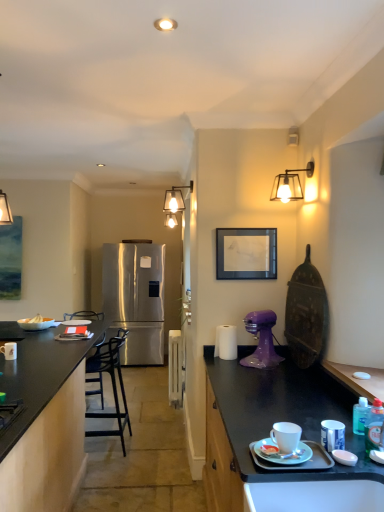
Question: From a real-world perspective, is white glossy book at center, the 1th tableware when ordered from bottom to top, below white matte plate at right, which is the second tableware from bottom to top?

Choices:
 (A) no
 (B) yes

Answer: (B)

Question: Is white glossy book at center, the 1th tableware when ordered from bottom to top, oriented away from white matte plate at right, which is the second tableware from bottom to top?

Choices:
 (A) yes
 (B) no

Answer: (B)

Question: Can you see white glossy book at center, the first tableware in the back-to-front sequence, touching white matte plate at right, which is the second tableware from bottom to top?

Choices:
 (A) yes
 (B) no

Answer: (B)

Question: Does white glossy book at center, the second tableware when ordered from top to bottom, have a greater width compared to white matte plate at right, the 1th tableware positioned from the front?

Choices:
 (A) no
 (B) yes

Answer: (B)

Question: Is white glossy book at center, placed as the 2th tableware when sorted from right to left, to the right of white matte plate at right, which is the second tableware from bottom to top, from the viewer's perspective?

Choices:
 (A) no
 (B) yes

Answer: (A)

Question: Based on their positions, is black matte countertop at left located to the left or right of stainless steel refrigerator at center?

Choices:
 (A) right
 (B) left

Answer: (B)

Question: From a real-world perspective, is black matte countertop at left physically located above or below stainless steel refrigerator at center?

Choices:
 (A) above
 (B) below

Answer: (B)

Question: Relative to stainless steel refrigerator at center, is black matte countertop at left in front or behind?

Choices:
 (A) front
 (B) behind

Answer: (A)

Question: Would you say black matte countertop at left is inside or outside stainless steel refrigerator at center?

Choices:
 (A) inside
 (B) outside

Answer: (B)

Question: From a real-world perspective, is matte glass lamp at center, the 1th lamp viewed from the left, above or below black metal bar stool at left?

Choices:
 (A) above
 (B) below

Answer: (A)

Question: In terms of height, does matte glass lamp at center, the second lamp when ordered from front to back, look taller or shorter compared to black metal bar stool at left?

Choices:
 (A) tall
 (B) short

Answer: (B)

Question: Is point (165, 199) positioned closer to the camera than point (94, 355)?

Choices:
 (A) closer
 (B) farther

Answer: (B)

Question: From the image's perspective, relative to black metal bar stool at left, is matte glass lamp at center, the 1th lamp viewed from the left, above or below?

Choices:
 (A) below
 (B) above

Answer: (B)

Question: Considering the positions of point (29, 328) and point (286, 190), is point (29, 328) closer or farther from the camera than point (286, 190)?

Choices:
 (A) farther
 (B) closer

Answer: (A)

Question: Is white matte bowl at left wider or thinner than metallic glass lampshade at upper right, which is the second lamp in back-to-front order?

Choices:
 (A) thin
 (B) wide

Answer: (B)